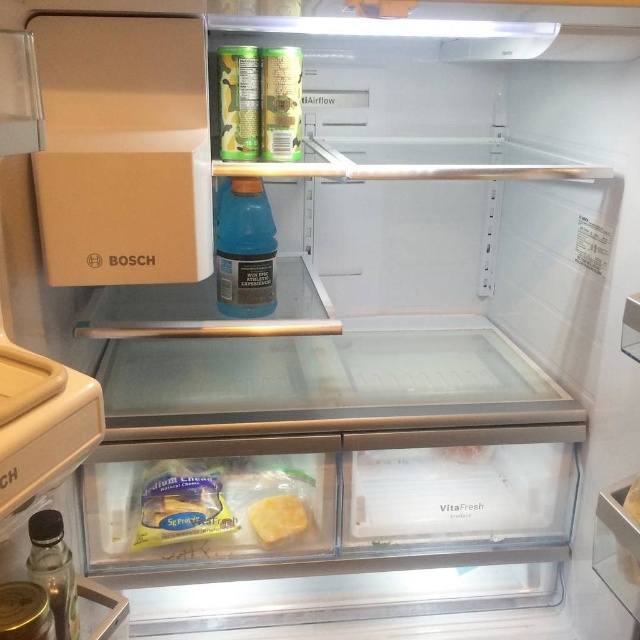
Who is more distant from viewer, (241, 260) or (54, 532)?

Point (241, 260)

Is blue translucent bottle at center positioned behind translucent glass bottle at lower left?

Yes, blue translucent bottle at center is behind translucent glass bottle at lower left.

Which is in front, point (244, 230) or point (65, 573)?

Point (65, 573)

Locate an element on the screen. The height and width of the screenshot is (640, 640). blue translucent bottle at center is located at coordinates (244, 250).

Can you confirm if translucent glass bottle at lower left is smaller than yellow cheese at lower center?

Incorrect, translucent glass bottle at lower left is not smaller in size than yellow cheese at lower center.

Who is taller, translucent glass bottle at lower left or yellow cheese at lower center?

With more height is translucent glass bottle at lower left.

Does point (45, 525) come farther from viewer compared to point (284, 532)?

No, it is in front of (284, 532).

Where is `translucent glass bottle at lower left`? This screenshot has height=640, width=640. translucent glass bottle at lower left is located at coordinates (52, 570).

Between yellow plastic cheese at lower center and yellow cheese at lower center, which one is positioned higher?

yellow plastic cheese at lower center is higher up.

Is point (214, 531) positioned in front of point (291, 506)?

That is True.

Where is `yellow plastic cheese at lower center`? The height and width of the screenshot is (640, 640). yellow plastic cheese at lower center is located at coordinates (221, 500).